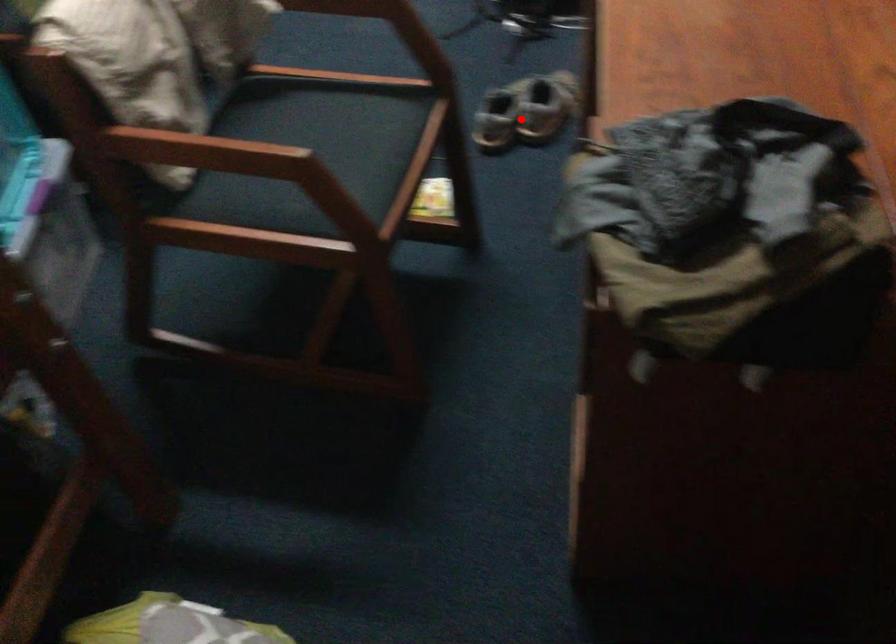
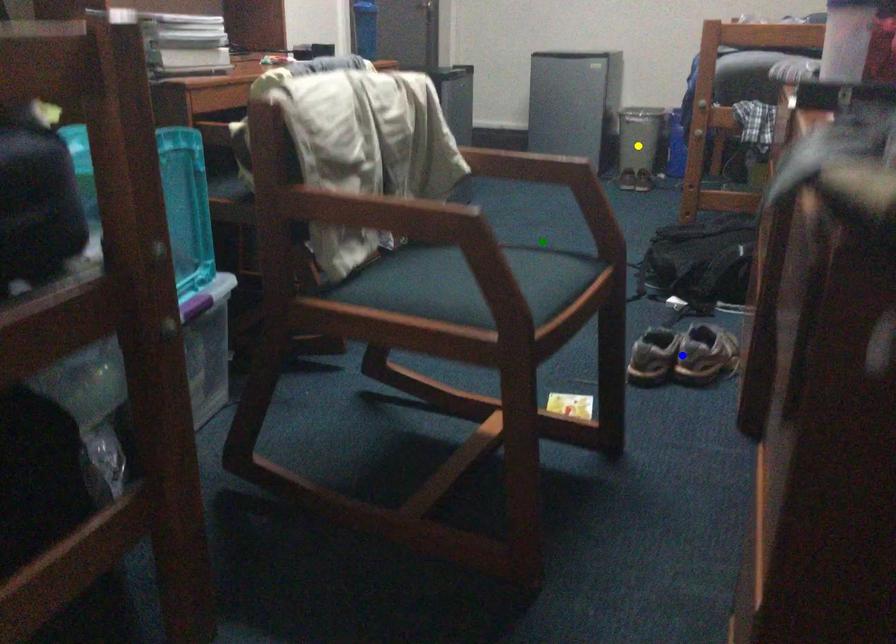
Question: I am providing you with two images of the same scene from different viewpoints. A red point is marked on the first image. You are given multiple points on the second image. Can you choose the point in image 2 that corresponds to the point in image 1?

Choices:
 (A) green point
 (B) yellow point
 (C) blue point

Answer: (C)